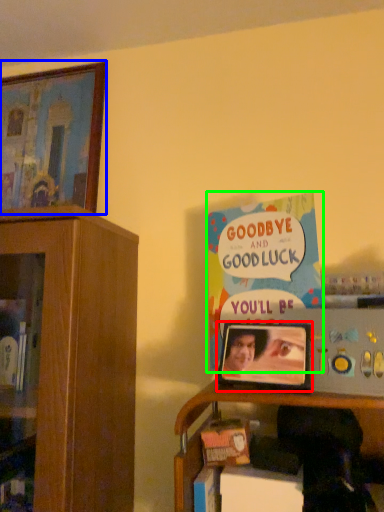
Question: Considering the real-world distances, which object is closest to picture frame (highlighted by a red box)? picture frame (highlighted by a blue box) or book (highlighted by a green box).

Choices:
 (A) picture frame
 (B) book

Answer: (B)